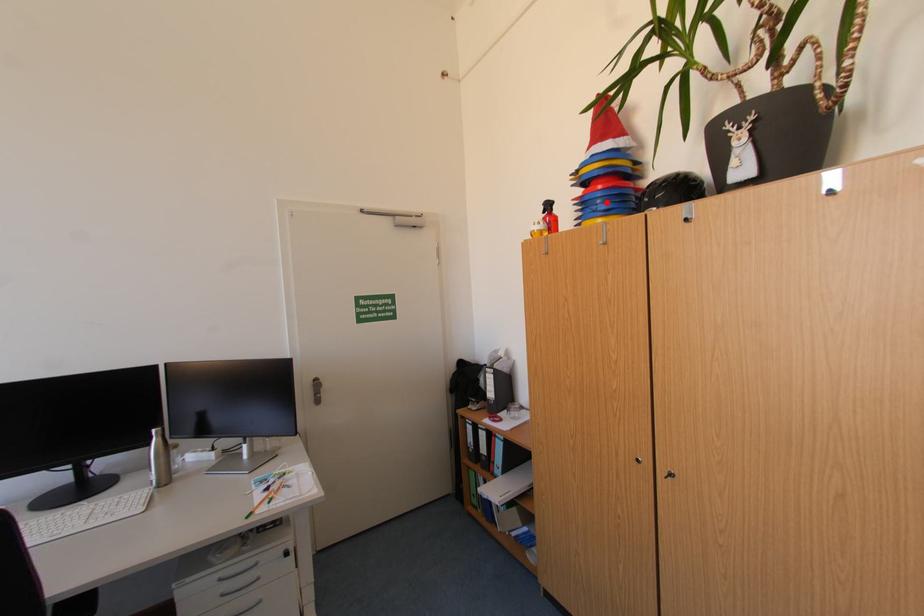
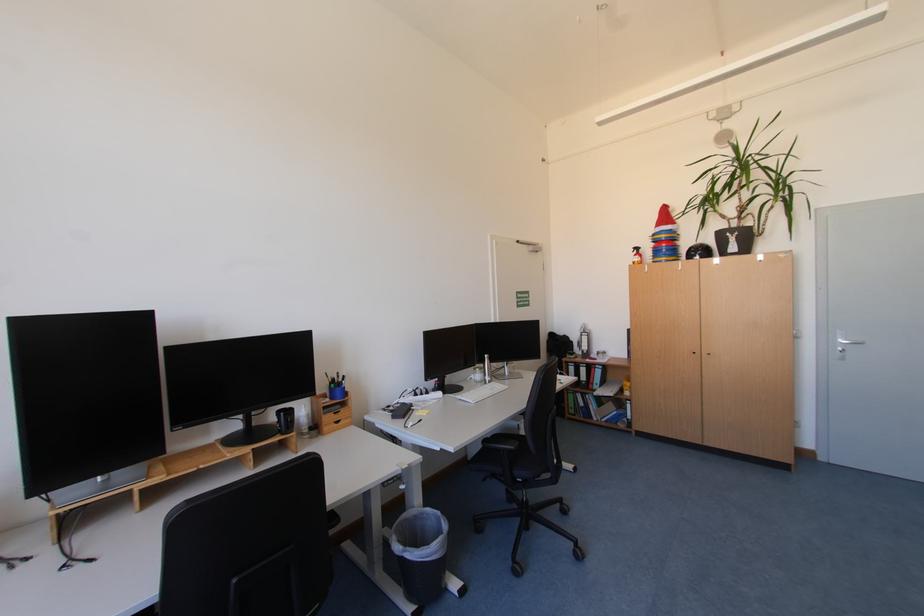
The point at the highlighted location is marked in the first image. Where is the corresponding point in the second image?

(672, 252)